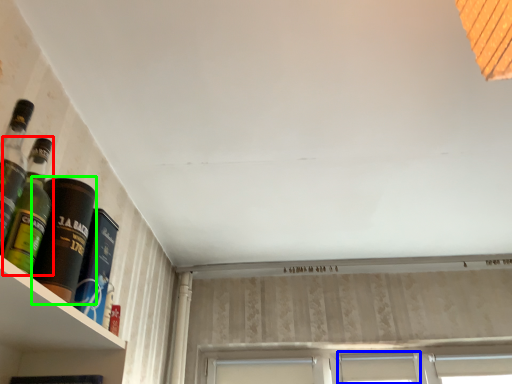
Question: Which object is positioned closest to bottle (highlighted by a red box)? Select from window (highlighted by a blue box) and bottle (highlighted by a green box).

Choices:
 (A) window
 (B) bottle

Answer: (B)